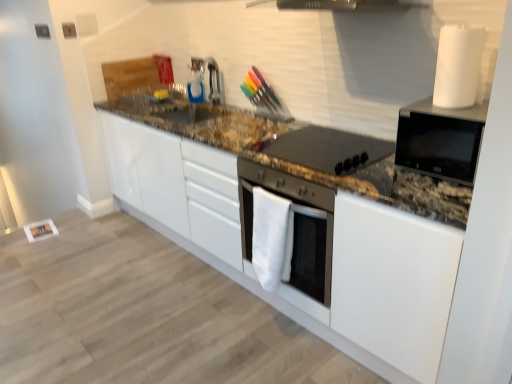
Question: Is point (291, 276) closer or farther from the camera than point (211, 66)?

Choices:
 (A) farther
 (B) closer

Answer: (B)

Question: From a real-world perspective, is white fabric oven at center, which is the second home appliance from right to left, physically located above or below satin nickel faucet at upper center?

Choices:
 (A) above
 (B) below

Answer: (B)

Question: Which object is the farthest from the black matte stovetop at center?

Choices:
 (A) black glossy microwave at upper right, which appears as the 2th home appliance when ordered from the bottom
 (B) granite at center
 (C) satin nickel faucet at upper center
 (D) white fabric oven at center, placed as the 1th home appliance when sorted from bottom to top

Answer: (C)

Question: Considering the real-world distances, which object is closest to the granite at center?

Choices:
 (A) white fabric oven at center, placed as the 1th home appliance when sorted from bottom to top
 (B) satin nickel faucet at upper center
 (C) black glossy microwave at upper right, which appears as the 2th home appliance when ordered from the bottom
 (D) black matte stovetop at center

Answer: (A)